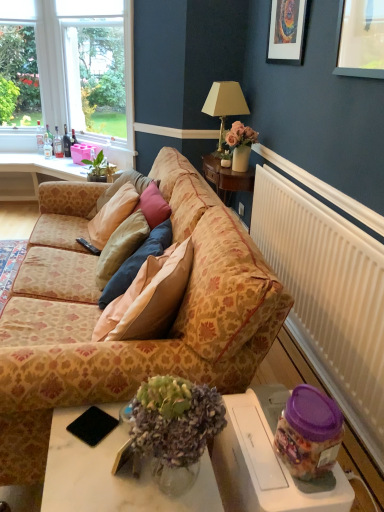
The width and height of the screenshot is (384, 512). What are the coordinates of `vacant area that lies in front of black matte pad at lower left` in the screenshot? It's located at (89, 472).